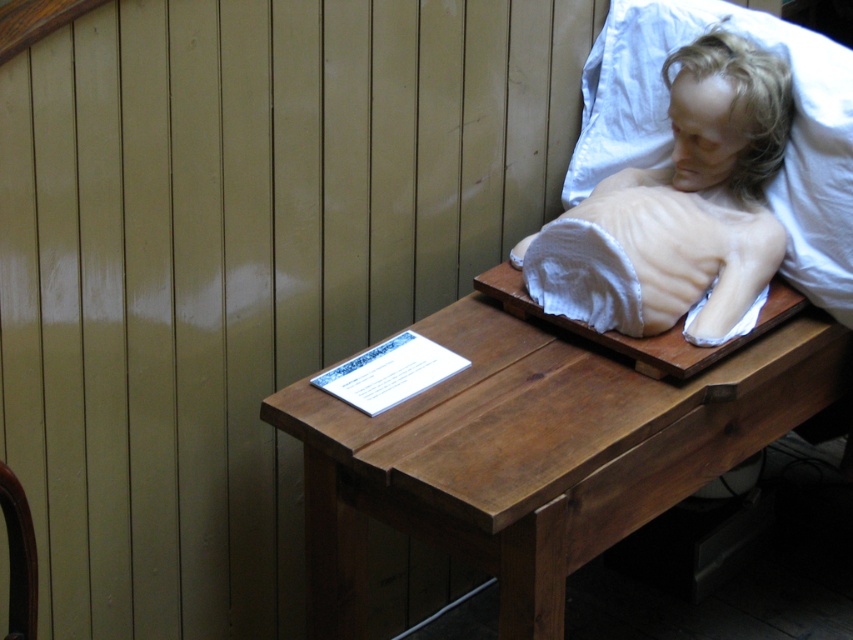
You are standing in a room with a wooden table at center. A point is marked at coordinates (543, 444). Is this point located on the wooden table at center?

The wooden table at center is represented by point (543, 444), so yes, the point is located on the wooden table at center.

Looking at this image, you are standing in front of the table and want to place a small object on the table. If you want to place it closer to the camera, which point should you choose between point (503, 397) and point (664, 216)?

You should choose point (503, 397) because it is closer to the camera than point (664, 216).

You are a person of average height standing in front of the wooden table at center and the smooth beige wax at upper right. Which object is taller?

The wooden table at center is taller than the smooth beige wax at upper right.